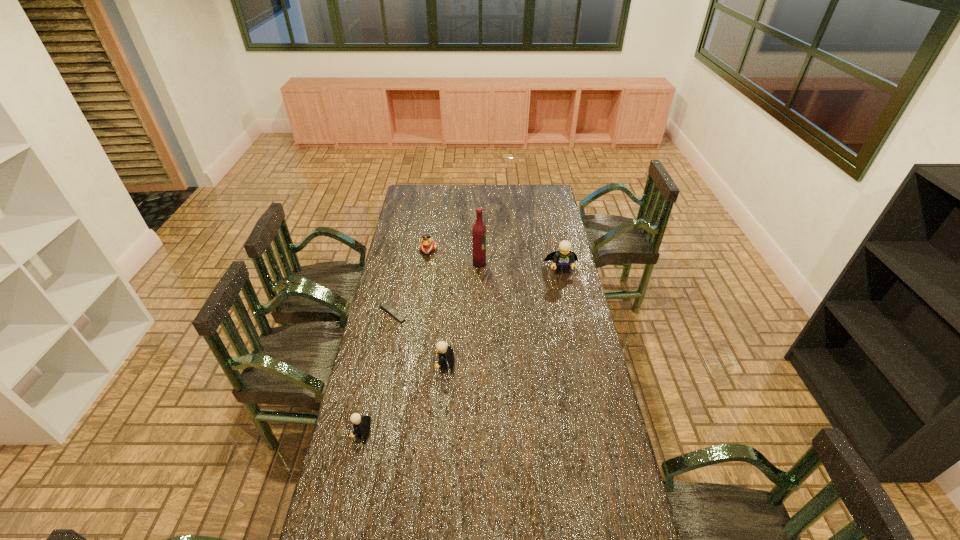
Find the location of a particular element. The width and height of the screenshot is (960, 540). vacant spot for a new Lego to ensure equal spacing is located at coordinates (510, 312).